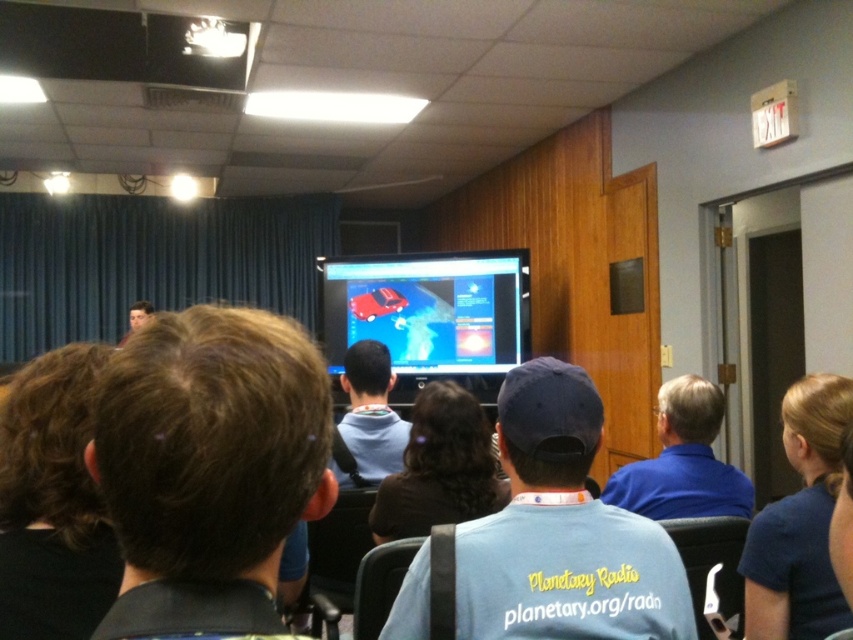
You are organizing a photo shoot and need to ensure that the blue shirt at lower right and the matte black laptop at upper left are both visible in the frame. Based on their sizes, which object might require more careful framing to avoid being too small in the photo?

The blue shirt at lower right has a smaller width than the matte black laptop at upper left, so it might require more careful framing to avoid appearing too small in the photo.

You are standing in the conference room and want to take a photo of the matte plastic screen at center from where you are. Your camera has a maximum focus range of 5 meters. Will you be able to capture the screen clearly?

The matte plastic screen at center is 5.11 meters away from the camera. Since the camera can only focus up to 5 meters, it won